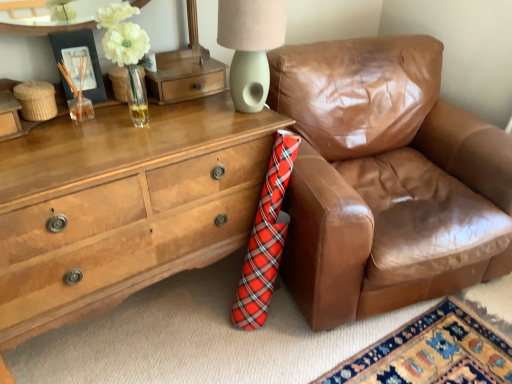
Question: Considering their positions, is matte green ceramic lampshade at upper center located in front of or behind wooden chest of drawers at lower left?

Choices:
 (A) behind
 (B) front

Answer: (A)

Question: In terms of height, does matte green ceramic lampshade at upper center look taller or shorter compared to wooden chest of drawers at lower left?

Choices:
 (A) tall
 (B) short

Answer: (B)

Question: Based on their relative distances, which object is farther from the wooden chest of drawers at lower left?

Choices:
 (A) matte green ceramic lampshade at upper center
 (B) brown leather chair at right
 (C) matte black picture frame at upper left

Answer: (B)

Question: Which of these objects is positioned farthest from the brown leather chair at right?

Choices:
 (A) wooden chest of drawers at lower left
 (B) matte green ceramic lampshade at upper center
 (C) matte black picture frame at upper left

Answer: (C)